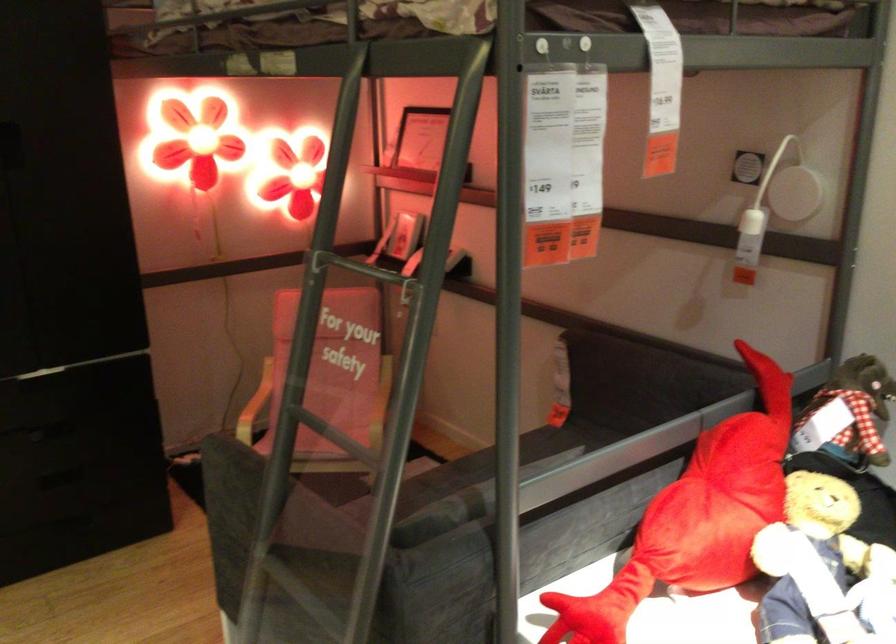
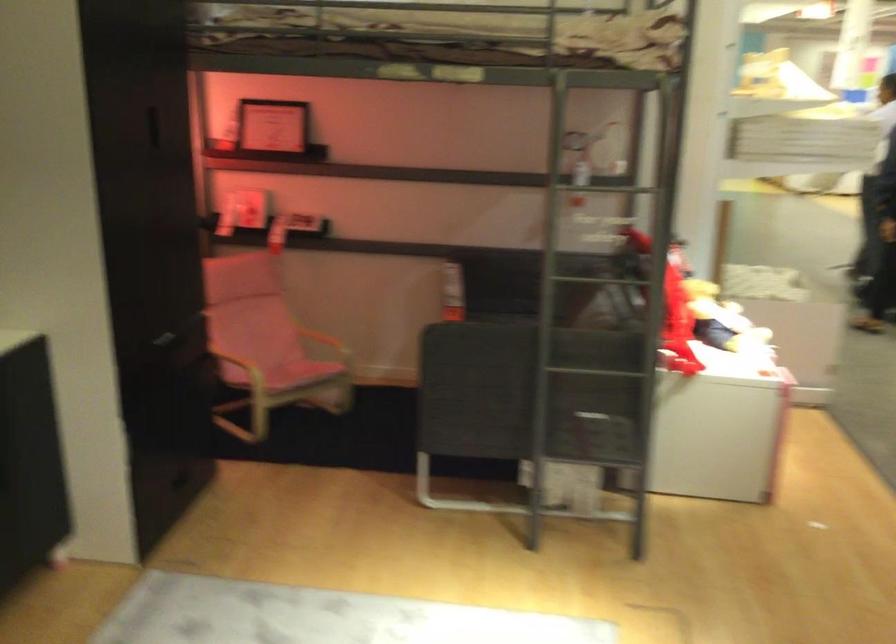
Find the pixel in the second image that matches point 109,362 in the first image.

(168, 337)